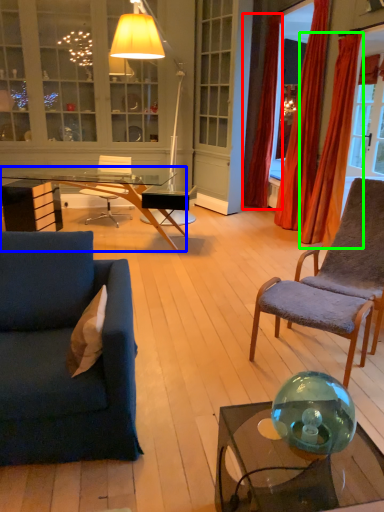
Question: Which object is the farthest from curtain (highlighted by a red box)? Choose among these: desk (highlighted by a blue box) or curtain (highlighted by a green box).

Choices:
 (A) desk
 (B) curtain

Answer: (A)